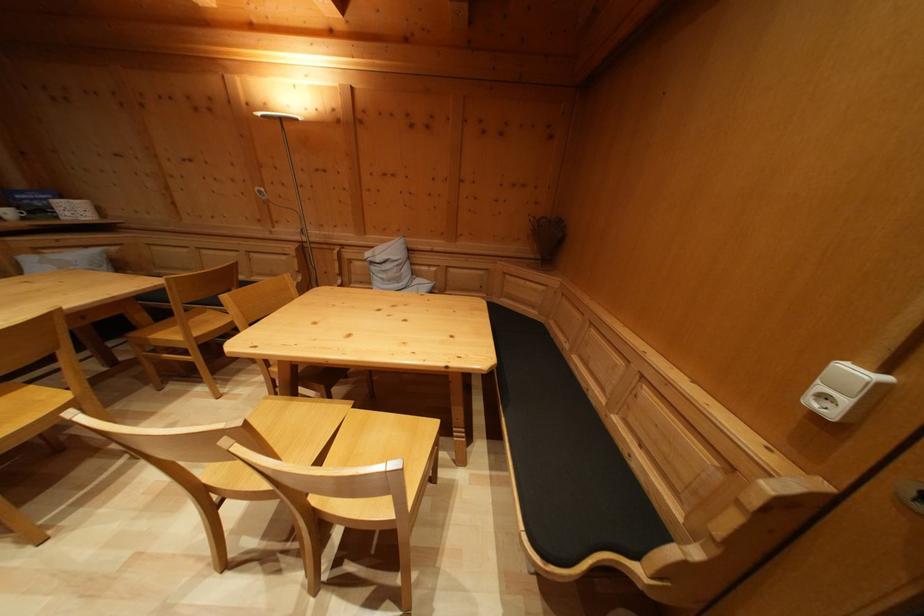
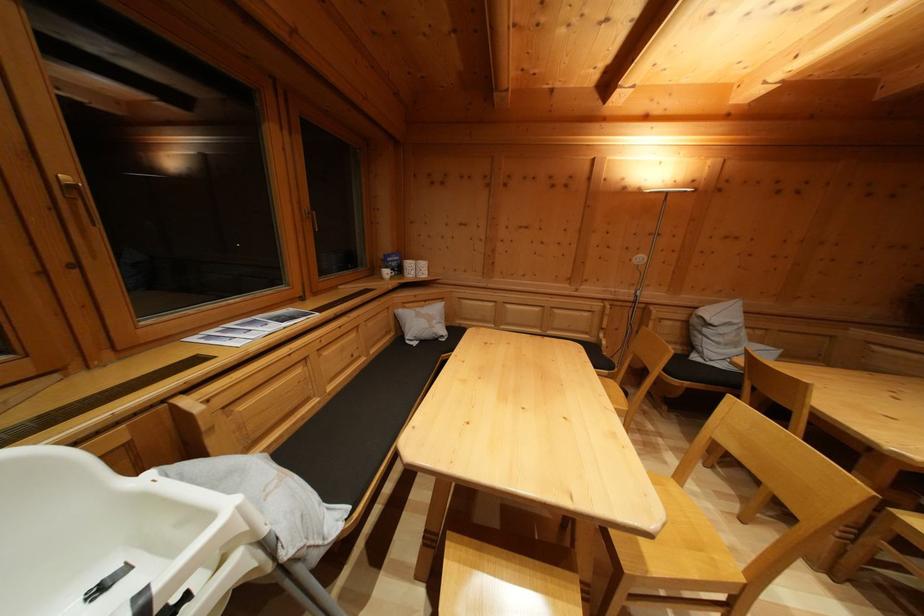
In the second image, find the point that corresponds to [92,254] in the first image.

(431, 308)